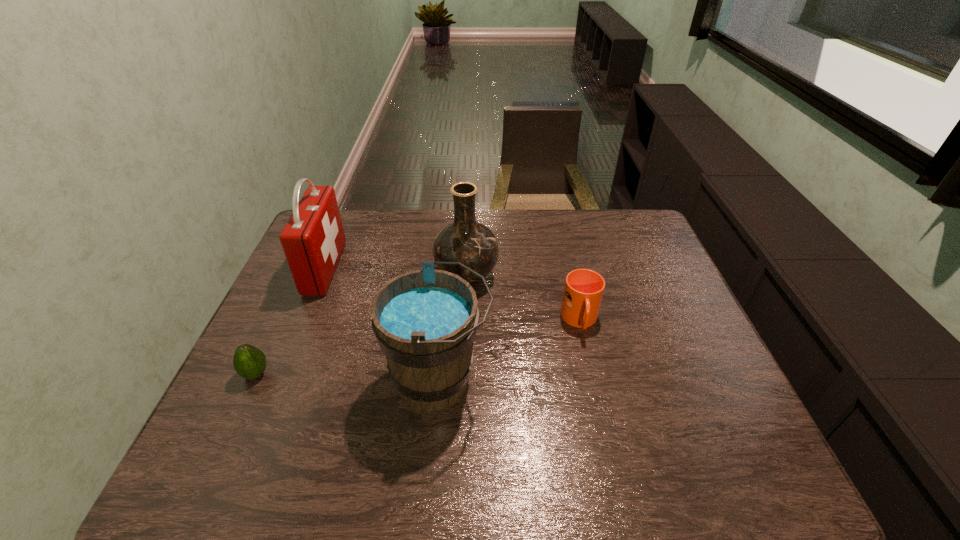
At what (x,y) coordinates should I click in order to perform the action: click on vacant point located 0.130m on the back of the shortest object. Please return your answer as a coordinate pair (x, y). Image resolution: width=960 pixels, height=540 pixels. Looking at the image, I should click on (279, 325).

Find the location of a particular element. This screenshot has width=960, height=540. object that is at the far edge is located at coordinates (313, 239).

At what (x,y) coordinates should I click in order to perform the action: click on the first-aid kit present at the left edge. Please return your answer as a coordinate pair (x, y). The width and height of the screenshot is (960, 540). Looking at the image, I should click on (313, 239).

This screenshot has height=540, width=960. Identify the location of avocado at the left edge. 249,362.

In order to click on object at the far left corner in this screenshot , I will do `click(313, 239)`.

Locate an element on the screen. The width and height of the screenshot is (960, 540). free location at the far edge of the desktop is located at coordinates (372, 215).

The image size is (960, 540). Identify the location of free point at the near edge. (587, 471).

Where is `vacant space at the left edge of the desktop`? The height and width of the screenshot is (540, 960). vacant space at the left edge of the desktop is located at coordinates (286, 356).

In the image, there is a desktop. Where is `blank space at the right edge`? Image resolution: width=960 pixels, height=540 pixels. blank space at the right edge is located at coordinates (633, 254).

The image size is (960, 540). Identify the location of vacant point located between the shortest object and the first-aid kit. (291, 321).